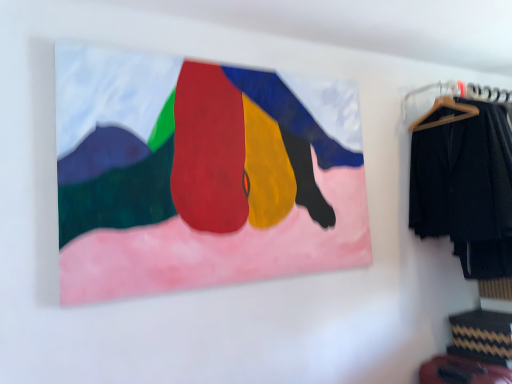
Find the location of a particular element. black fabric pants at right is located at coordinates (463, 173).

I want to click on matte canvas painting at upper center, so click(x=201, y=174).

The width and height of the screenshot is (512, 384). What are the coordinates of `wooden hanger at upper right` in the screenshot? It's located at (442, 106).

Which object is positioned more to the left, wooden hanger at upper right or black fabric pants at right?

From the viewer's perspective, wooden hanger at upper right appears more on the left side.

The width and height of the screenshot is (512, 384). Find the location of `closet lying in front of the wooden hanger at upper right`. closet lying in front of the wooden hanger at upper right is located at coordinates (463, 173).

From the image's perspective, is wooden hanger at upper right located above black fabric pants at right?

Yes, from the image's perspective, wooden hanger at upper right is above black fabric pants at right.

In the scene shown: Between wooden hanger at upper right and black fabric pants at right, which one has larger size?

Bigger between the two is black fabric pants at right.

From the image's perspective, is matte canvas painting at upper center above or below wooden hanger at upper right?

Clearly, from the image's perspective, matte canvas painting at upper center is below wooden hanger at upper right.

Could you tell me if matte canvas painting at upper center is turned towards wooden hanger at upper right?

No, matte canvas painting at upper center is not aimed at wooden hanger at upper right.

From a real-world perspective, who is located lower, matte canvas painting at upper center or wooden hanger at upper right?

matte canvas painting at upper center, from a real-world perspective.

Between point (412, 160) and point (327, 97), which one is positioned behind?

Point (412, 160)

Between black fabric pants at right and matte canvas painting at upper center, which one has smaller width?

With smaller width is matte canvas painting at upper center.

From the image's perspective, which is below, black fabric pants at right or matte canvas painting at upper center?

From the image's view, black fabric pants at right is below.

Based on their sizes in the image, would you say black fabric pants at right is bigger or smaller than matte canvas painting at upper center?

Clearly, black fabric pants at right is larger in size than matte canvas painting at upper center.

How different are the orientations of matte canvas painting at upper center and black fabric pants at right in degrees?

They differ by 0.795 degrees in their facing directions.

Does point (272, 204) come behind point (499, 157)?

No, (272, 204) is closer to viewer.

Is matte canvas painting at upper center oriented away from black fabric pants at right?

No.

Would you say matte canvas painting at upper center is inside or outside black fabric pants at right?

matte canvas painting at upper center is spatially situated outside black fabric pants at right.

Is wooden hanger at upper right not inside matte canvas painting at upper center?

Yes, wooden hanger at upper right is not within matte canvas painting at upper center.

Can you tell me how much wooden hanger at upper right and matte canvas painting at upper center differ in facing direction?

The angular difference between wooden hanger at upper right and matte canvas painting at upper center is 0.795 degrees.

Is wooden hanger at upper right oriented towards matte canvas painting at upper center?

No, wooden hanger at upper right is not facing towards matte canvas painting at upper center.

Relative to matte canvas painting at upper center, is wooden hanger at upper right in front or behind?

wooden hanger at upper right is positioned farther from the viewer than matte canvas painting at upper center.

How many degrees apart are the facing directions of black fabric pants at right and wooden hanger at upper right?

They differ by 0.000814 degrees in their facing directions.

From the image's perspective, would you say black fabric pants at right is positioned over wooden hanger at upper right?

No.

Is black fabric pants at right far from wooden hanger at upper right?

No.

Locate an element on the screen. The height and width of the screenshot is (384, 512). hanger above the black fabric pants at right (from the image's perspective) is located at coordinates coord(442,106).

Locate an element on the screen. This screenshot has height=384, width=512. hanger above the black fabric pants at right (from a real-world perspective) is located at coordinates (442, 106).

Identify the location of hanger above the matte canvas painting at upper center (from the image's perspective). The height and width of the screenshot is (384, 512). (442, 106).

When comparing their distances from matte canvas painting at upper center, does black fabric pants at right or wooden hanger at upper right seem closer?

black fabric pants at right.

Considering their positions, is matte canvas painting at upper center positioned further to black fabric pants at right than wooden hanger at upper right?

Among the two, matte canvas painting at upper center is located further to black fabric pants at right.

Based on their spatial positions, is wooden hanger at upper right or black fabric pants at right closer to matte canvas painting at upper center?

black fabric pants at right lies closer to matte canvas painting at upper center than the other object.

Based on their spatial positions, is black fabric pants at right or matte canvas painting at upper center further from wooden hanger at upper right?

Among the two, matte canvas painting at upper center is located further to wooden hanger at upper right.

Considering their positions, is matte canvas painting at upper center positioned further to wooden hanger at upper right than black fabric pants at right?

matte canvas painting at upper center is positioned further to the anchor wooden hanger at upper right.

Considering their positions, is wooden hanger at upper right positioned further to black fabric pants at right than matte canvas painting at upper center?

Based on the image, matte canvas painting at upper center appears to be further to black fabric pants at right.

Identify the location of hanger between matte canvas painting at upper center and black fabric pants at right from left to right. This screenshot has width=512, height=384. (442, 106).